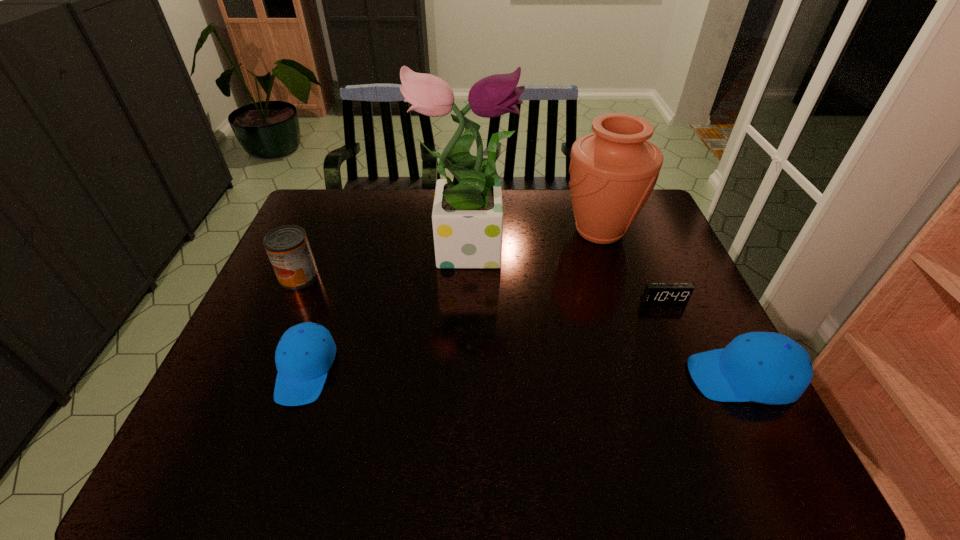
To make them evenly spaced by inserting another cap_(headwear) among them, please locate a vacant spot for this new cap_(headwear). Please provide its 2D coordinates. Your answer should be formatted as a tuple, i.e. [(x, y)], where the tuple contains the x and y coordinates of a point satisfying the conditions above.

[(523, 373)]